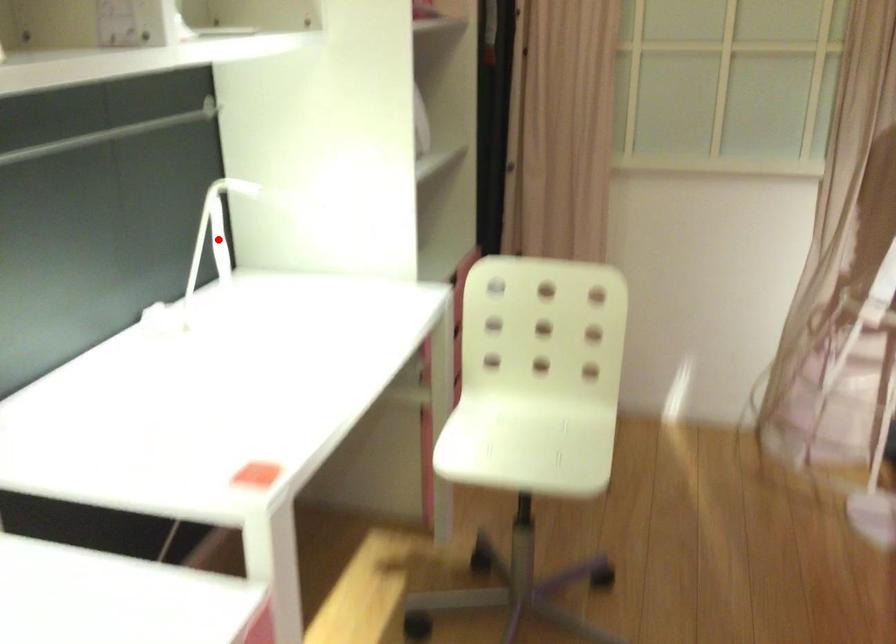
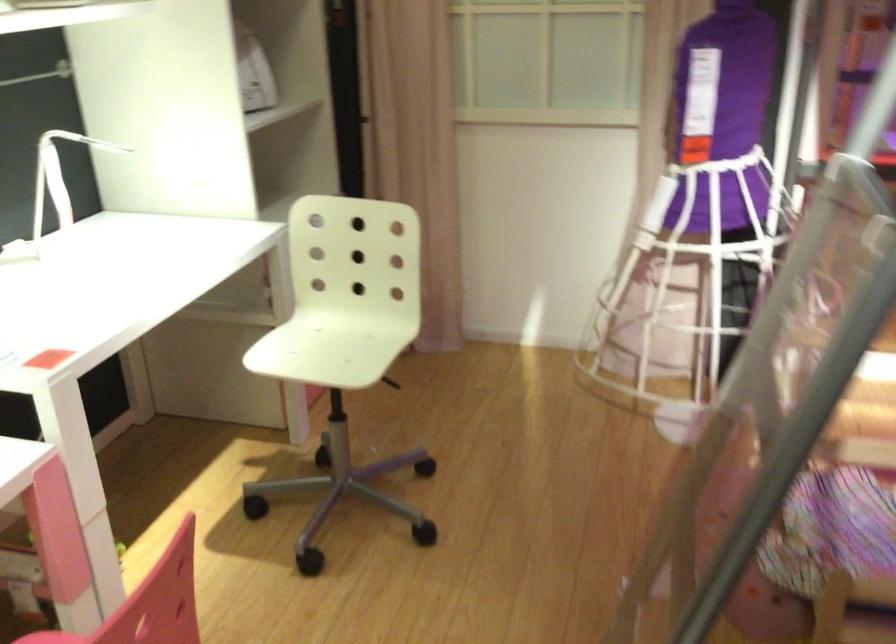
In the second image, find the point that corresponds to the highlighted location in the first image.

(58, 176)